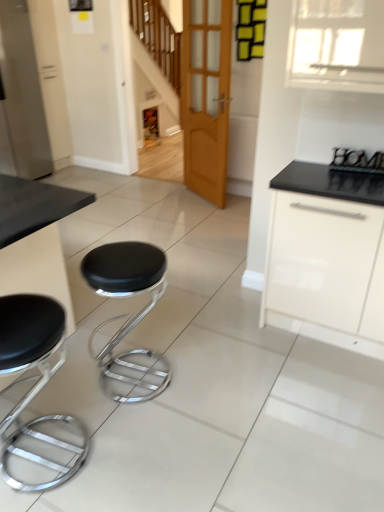
Question: From a real-world perspective, is metallic black sign at upper right, which is the first appliance in front-to-back order, positioned above or below black leather stool at center, which appears as the first stool when viewed from the right?

Choices:
 (A) above
 (B) below

Answer: (A)

Question: In the image, is metallic black sign at upper right, positioned as the 2th appliance in back-to-front order, positioned in front of or behind black leather stool at center, which is the second stool from left to right?

Choices:
 (A) behind
 (B) front

Answer: (A)

Question: Which of these objects is positioned farthest from the metallic black sign at upper right, positioned as the 2th appliance in back-to-front order?

Choices:
 (A) satin white refrigerator at left, which ranks as the 2th appliance in right-to-left order
 (B) black leather stool at lower left, the 2th stool from the right
 (C) white glossy cabinet at right
 (D) wooden door at center
 (E) black leather stool at center, which appears as the first stool when viewed from the right

Answer: (A)

Question: Which is farther from the black leather stool at center, which is the second stool from left to right?

Choices:
 (A) black leather stool at lower left, the 2th stool from the right
 (B) white glossy cabinet at right
 (C) wooden door at center
 (D) satin white refrigerator at left, which ranks as the first appliance in back-to-front order
 (E) metallic black sign at upper right, which is the 2th appliance from left to right

Answer: (D)